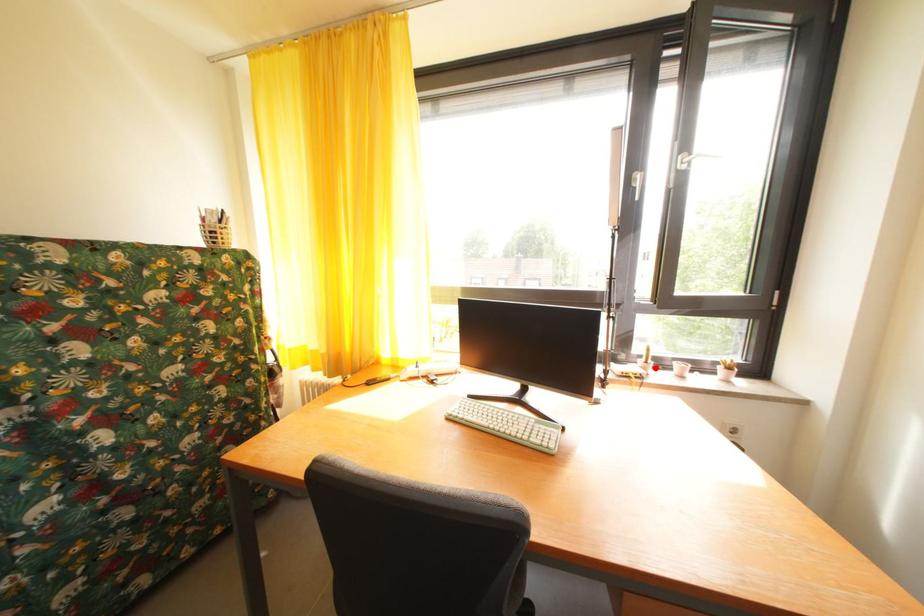
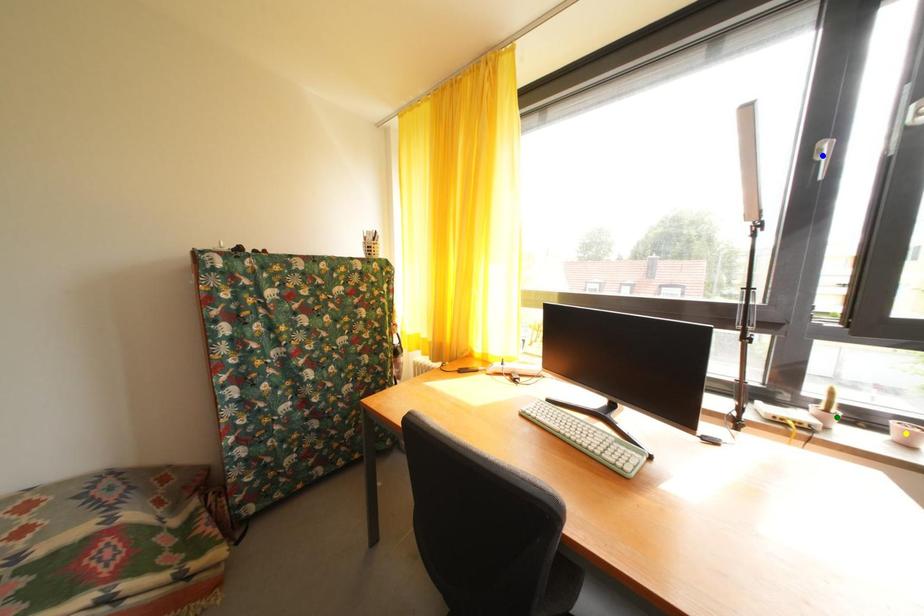
Question: I am providing you with two images of the same scene from different viewpoints. A red point is marked on the first image. You are given multiple points on the second image. Which spot in image 2 lines up with the point in image 1?

Choices:
 (A) yellow point
 (B) blue point
 (C) green point

Answer: (C)